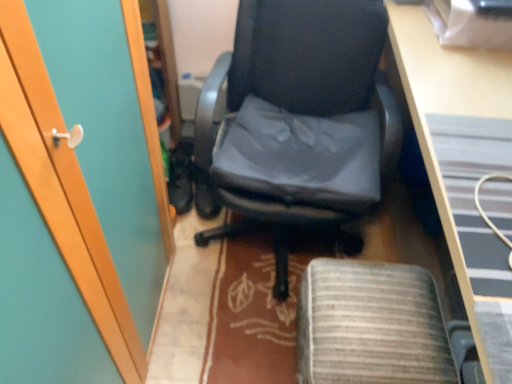
Question: From the image's perspective, is black leather chair at center located above wooden desk at center?

Choices:
 (A) yes
 (B) no

Answer: (A)

Question: From a real-world perspective, is black leather chair at center physically above wooden desk at center?

Choices:
 (A) no
 (B) yes

Answer: (A)

Question: Is the position of black leather chair at center less distant than that of wooden desk at center?

Choices:
 (A) yes
 (B) no

Answer: (B)

Question: Considering the relative sizes of black leather chair at center and wooden desk at center in the image provided, is black leather chair at center smaller than wooden desk at center?

Choices:
 (A) yes
 (B) no

Answer: (A)

Question: Is black leather chair at center not close to wooden desk at center?

Choices:
 (A) yes
 (B) no

Answer: (B)

Question: Is black leather chair at center thinner than wooden desk at center?

Choices:
 (A) yes
 (B) no

Answer: (B)

Question: Can you confirm if gray fabric computer chair at center is taller than black leather chair at center?

Choices:
 (A) yes
 (B) no

Answer: (B)

Question: From a real-world perspective, is gray fabric computer chair at center positioned over black leather chair at center based on gravity?

Choices:
 (A) yes
 (B) no

Answer: (B)

Question: From the image's perspective, does gray fabric computer chair at center appear lower than black leather chair at center?

Choices:
 (A) yes
 (B) no

Answer: (A)

Question: Considering the relative sizes of gray fabric computer chair at center and black leather chair at center in the image provided, is gray fabric computer chair at center bigger than black leather chair at center?

Choices:
 (A) no
 (B) yes

Answer: (A)

Question: Is gray fabric computer chair at center facing away from black leather chair at center?

Choices:
 (A) yes
 (B) no

Answer: (A)

Question: Can you confirm if gray fabric computer chair at center is positioned to the right of black leather chair at center?

Choices:
 (A) yes
 (B) no

Answer: (A)

Question: From the image's perspective, is black leather chair at center above gray fabric computer chair at center?

Choices:
 (A) no
 (B) yes

Answer: (B)